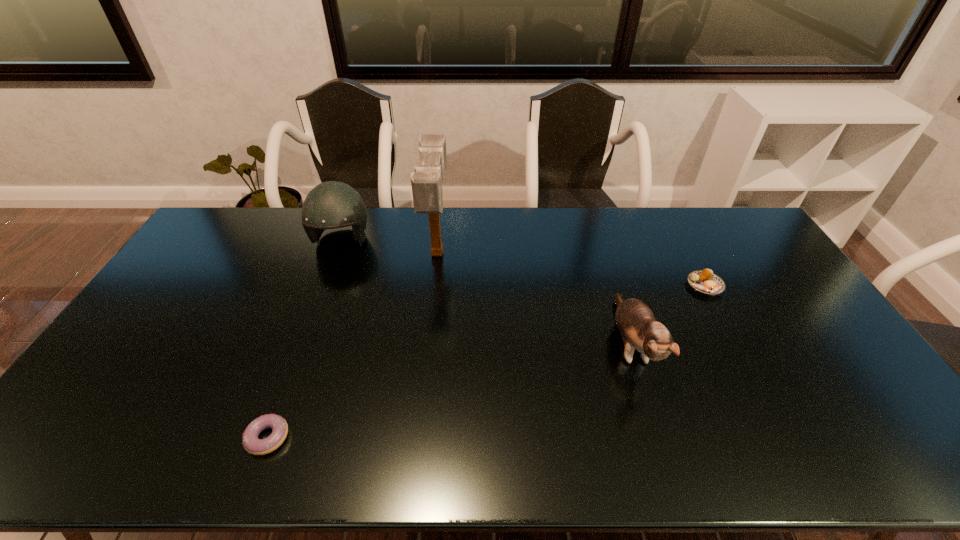
You are a GUI agent. You are given a task and a screenshot of the screen. Output one action in this format:
    pyautogui.click(x=<x>, y=<y>)
    Task: Click on the third object from left to right
    
    Given the screenshot: What is the action you would take?
    pyautogui.click(x=426, y=181)

I want to click on mallet, so click(426, 181).

I want to click on football helmet, so click(330, 205).

The width and height of the screenshot is (960, 540). Find the location of `cat`. cat is located at coordinates (637, 324).

The height and width of the screenshot is (540, 960). What are the coordinates of `pastry` in the screenshot? It's located at (704, 281).

Where is `the nearest object`? The width and height of the screenshot is (960, 540). the nearest object is located at coordinates (252, 444).

Identify the location of vacant space located on the front of the mallet. (425, 363).

Find the location of a particular element. free space located 0.200m at the face opening of the football helmet is located at coordinates (319, 305).

Image resolution: width=960 pixels, height=540 pixels. Find the location of `blank space located 0.120m at the face of the fourth object from left to right`. blank space located 0.120m at the face of the fourth object from left to right is located at coordinates (662, 447).

In order to click on free spot located on the back of the pastry in this screenshot , I will do `click(679, 237)`.